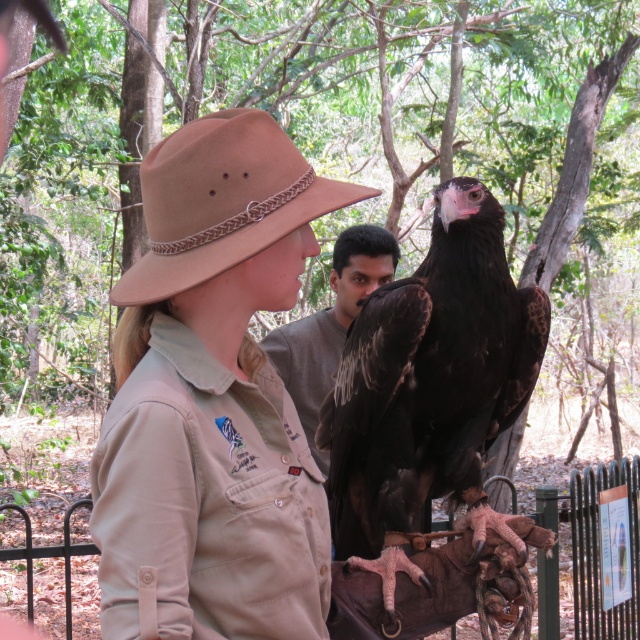
Who is positioned more to the left, tan canvas hat at upper left or dark brown feathers at center?

tan canvas hat at upper left

Can you confirm if tan canvas hat at upper left is wider than dark brown feathers at center?

In fact, tan canvas hat at upper left might be narrower than dark brown feathers at center.

Between point (301, 212) and point (417, 566), which one is positioned in front?

Point (301, 212) is in front.

You are a GUI agent. You are given a task and a screenshot of the screen. Output one action in this format:
    pyautogui.click(x=<x>, y=<y>)
    Task: Click on the tan canvas hat at upper left
    The width and height of the screenshot is (640, 640).
    Given the screenshot: What is the action you would take?
    pyautogui.click(x=212, y=397)

Does tan canvas hat at upper left come in front of dark gray shirt at center?

Yes, it is.

Between tan canvas hat at upper left and dark gray shirt at center, which one has less height?

tan canvas hat at upper left

At what (x,y) coordinates should I click in order to perform the action: click on tan canvas hat at upper left. Please return your answer as a coordinate pair (x, y). Looking at the image, I should click on (212, 397).

Locate an element on the screen. tan canvas hat at upper left is located at coordinates (212, 397).

Who is lower down, dark brown feathers at center or dark gray shirt at center?

dark brown feathers at center is below.

The image size is (640, 640). What are the coordinates of `dark brown feathers at center` in the screenshot? It's located at (429, 390).